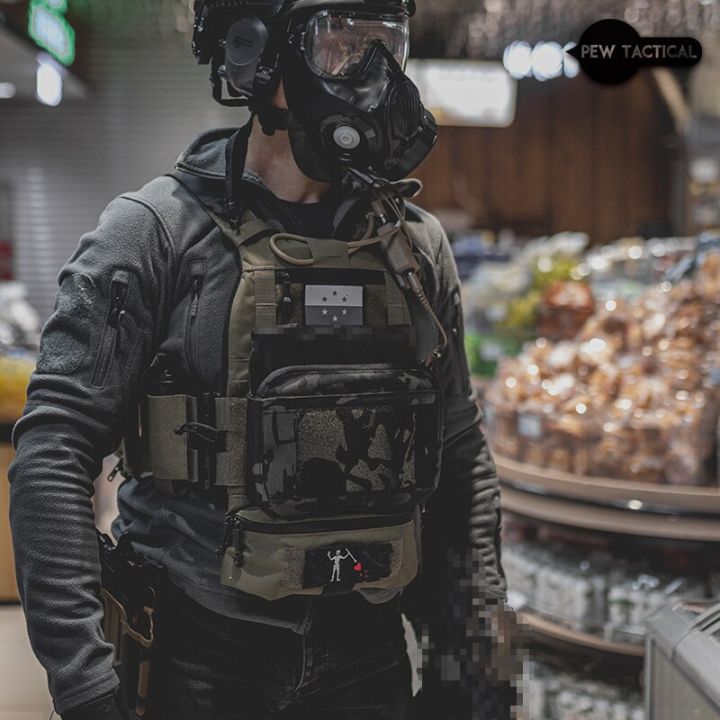
Identify the location of cord. The image size is (720, 720). (410, 243).